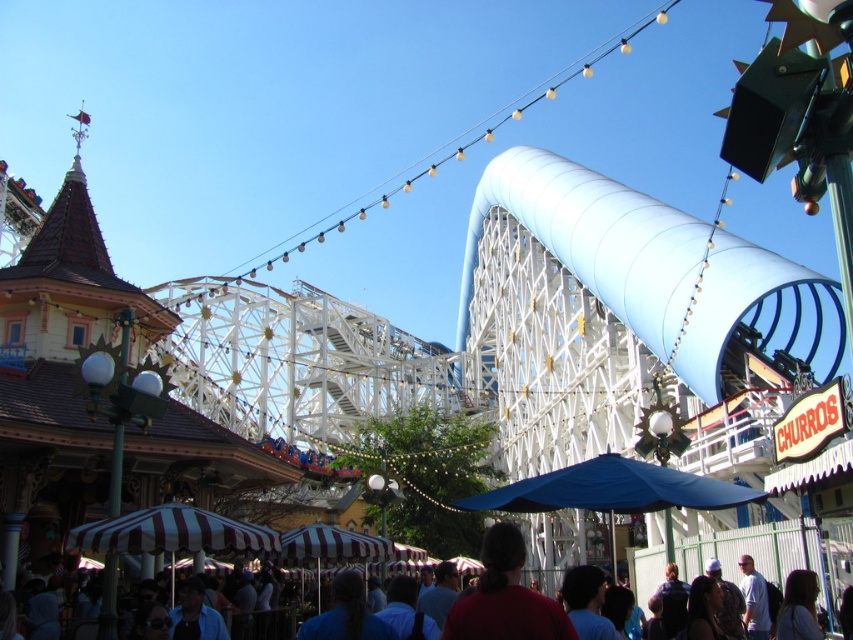
Question: Does blue striped umbrella at lower center appear on the left side of red matte shirt at center?

Choices:
 (A) yes
 (B) no

Answer: (B)

Question: Among these points, which one is nearest to the camera?

Choices:
 (A) (469, 636)
 (B) (834, 525)

Answer: (A)

Question: Is blue striped umbrella at lower center thinner than red matte shirt at center?

Choices:
 (A) no
 (B) yes

Answer: (A)

Question: Is blue striped umbrella at lower center wider than red matte shirt at center?

Choices:
 (A) yes
 (B) no

Answer: (A)

Question: Which of the following is the closest to the observer?

Choices:
 (A) (775, 541)
 (B) (523, 589)

Answer: (B)